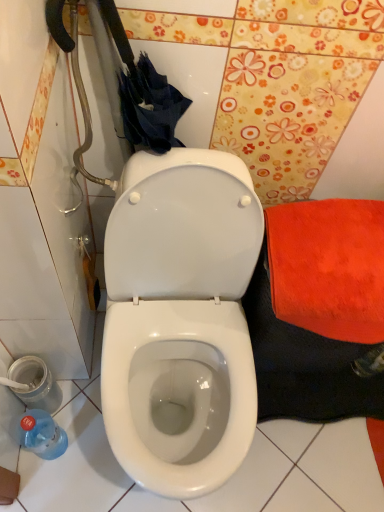
Question: Is blue plastic bottle at lower left in contact with metallic silver potty at lower left?

Choices:
 (A) yes
 (B) no

Answer: (B)

Question: Does blue plastic bottle at lower left turn towards metallic silver potty at lower left?

Choices:
 (A) no
 (B) yes

Answer: (A)

Question: Is blue plastic bottle at lower left turned away from metallic silver potty at lower left?

Choices:
 (A) no
 (B) yes

Answer: (A)

Question: Does blue plastic bottle at lower left have a lesser width compared to metallic silver potty at lower left?

Choices:
 (A) no
 (B) yes

Answer: (B)

Question: Is blue plastic bottle at lower left at the left side of metallic silver potty at lower left?

Choices:
 (A) no
 (B) yes

Answer: (A)

Question: From the image's perspective, is blue plastic bottle at lower left beneath metallic silver potty at lower left?

Choices:
 (A) yes
 (B) no

Answer: (A)

Question: Considering the relative sizes of metallic silver potty at lower left and blue plastic bottle at lower left in the image provided, is metallic silver potty at lower left bigger than blue plastic bottle at lower left?

Choices:
 (A) yes
 (B) no

Answer: (B)

Question: Considering the relative sizes of metallic silver potty at lower left and blue plastic bottle at lower left in the image provided, is metallic silver potty at lower left thinner than blue plastic bottle at lower left?

Choices:
 (A) no
 (B) yes

Answer: (A)

Question: Could you tell me if metallic silver potty at lower left is turned towards blue plastic bottle at lower left?

Choices:
 (A) no
 (B) yes

Answer: (A)

Question: Is metallic silver potty at lower left beside blue plastic bottle at lower left?

Choices:
 (A) yes
 (B) no

Answer: (B)

Question: From the image's perspective, does metallic silver potty at lower left appear higher than blue plastic bottle at lower left?

Choices:
 (A) yes
 (B) no

Answer: (A)

Question: Is metallic silver potty at lower left smaller than blue plastic bottle at lower left?

Choices:
 (A) no
 (B) yes

Answer: (B)

Question: Is blue plastic bottle at lower left in front of or behind metallic silver potty at lower left in the image?

Choices:
 (A) behind
 (B) front

Answer: (B)